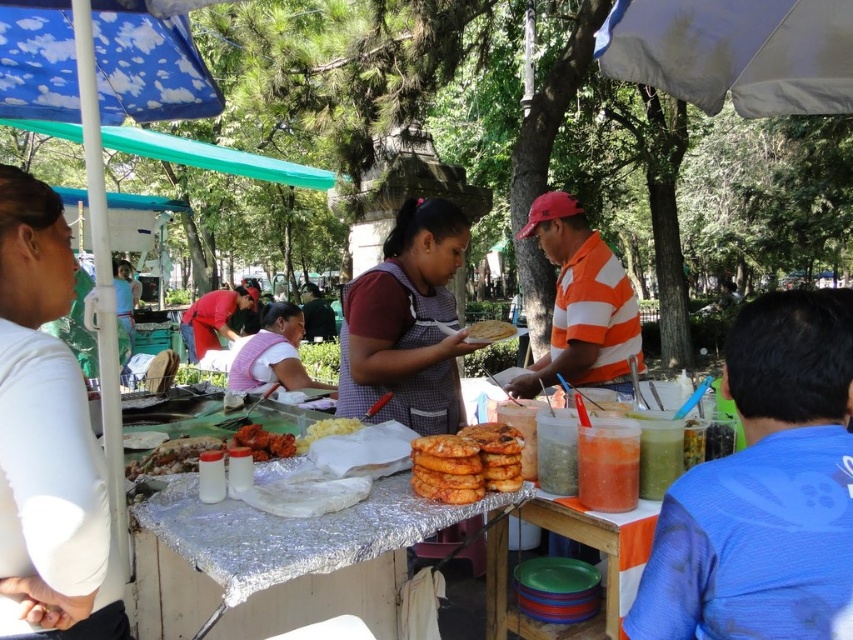
You are a customer at the food stall and want to grab a plate from the stack on the silver foil table at center. However, you notice the blue fabric shirt at right is blocking your view. Can you reach the table without moving the shirt?

The blue fabric shirt at right has a greater height compared to silver foil table at center, so it might block your view or access to the table. You may need to move the shirt to reach the table.